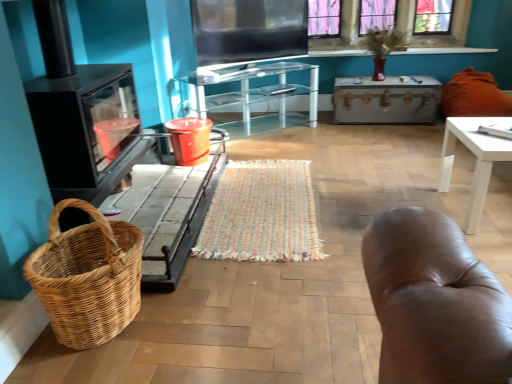
Question: Is woven multicolored mat at center spatially inside white glossy table at right, or outside of it?

Choices:
 (A) inside
 (B) outside

Answer: (B)

Question: Considering the positions of woven multicolored mat at center and white glossy table at right in the image, is woven multicolored mat at center wider or thinner than white glossy table at right?

Choices:
 (A) wide
 (B) thin

Answer: (A)

Question: Which is nearer to the flat matte screen at upper center?

Choices:
 (A) woven multicolored mat at center
 (B) woven brown picnic basket at lower left
 (C) pink glass window at upper center
 (D) transparent glass cabinet at center
 (E) white glossy table at right

Answer: (D)

Question: Estimate the real-world distances between objects in this image. Which object is closer to the woven multicolored mat at center?

Choices:
 (A) orange fabric pillow at right
 (B) transparent glass cabinet at center
 (C) white glossy table at right
 (D) woven brown picnic basket at lower left
 (E) black glass fireplace at left

Answer: (D)